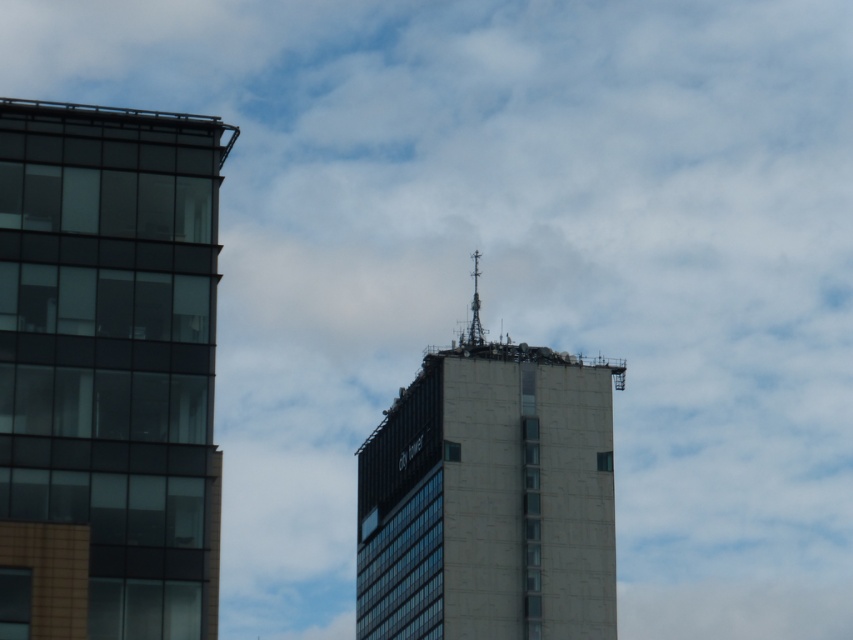
Which is below, transparent glass building at left or concrete tower at center?

concrete tower at center is below.

Can you confirm if transparent glass building at left is smaller than concrete tower at center?

Yes.

Who is more forward, (26, 237) or (537, 390)?

Point (26, 237) is in front.

Image resolution: width=853 pixels, height=640 pixels. I want to click on transparent glass building at left, so 107,371.